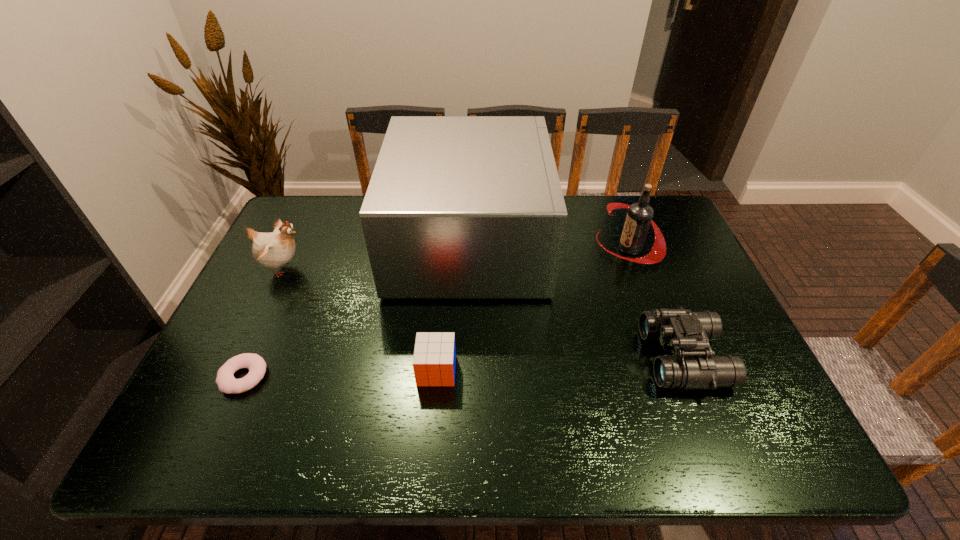
Identify the location of vacant area between the root beer and the binoculars. (657, 303).

At what (x,y) coordinates should I click in order to perform the action: click on vacant area that lies between the microwave oven and the binoculars. Please return your answer as a coordinate pair (x, y). Looking at the image, I should click on (577, 300).

You are a GUI agent. You are given a task and a screenshot of the screen. Output one action in this format:
    pyautogui.click(x=<x>, y=<y>)
    Task: Click on the vacant area between the binoculars and the microwave oven
    The height and width of the screenshot is (540, 960).
    Given the screenshot: What is the action you would take?
    pyautogui.click(x=577, y=300)

Identify the location of empty space that is in between the root beer and the binoculars. Image resolution: width=960 pixels, height=540 pixels. (657, 303).

Identify the location of free space that is in between the shortest object and the root beer. (437, 312).

What are the coordinates of `object that is the nearest to the microwave oven` in the screenshot? It's located at (639, 217).

Locate an element on the screen. This screenshot has height=540, width=960. object identified as the third closest to the second tallest object is located at coordinates (434, 359).

At what (x,y) coordinates should I click in order to perform the action: click on free region that satisfies the following two spatial constraints: 1. on the back side of the doughnut; 2. at the beak of the fourth shortest object. Please return your answer as a coordinate pair (x, y). Looking at the image, I should click on (292, 268).